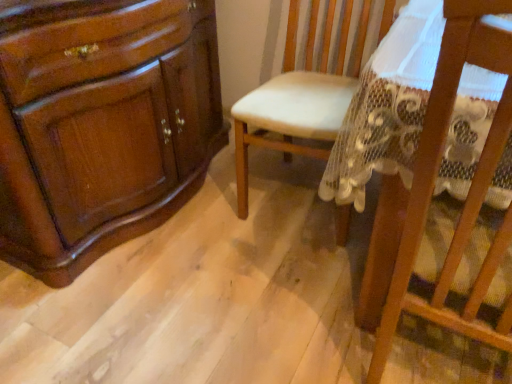
Where is `free location in front of white leather chair at center, which is counted as the second chair, starting from the front`? The width and height of the screenshot is (512, 384). free location in front of white leather chair at center, which is counted as the second chair, starting from the front is located at coordinates (260, 277).